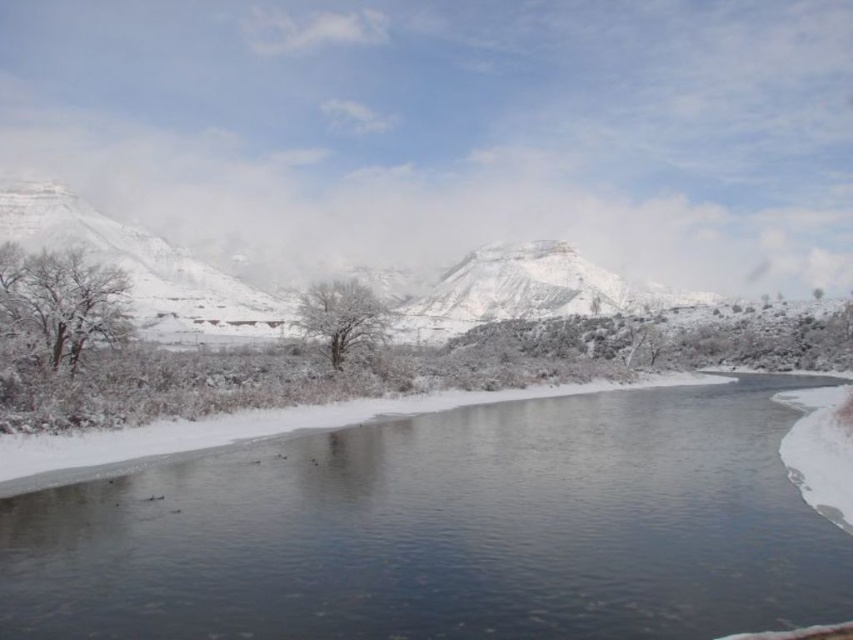
Is snow-covered tree at left wider than white frosty tree at center?

Yes, snow-covered tree at left is wider than white frosty tree at center.

In the scene shown: Is snow-covered tree at left to the right of white frosty tree at center from the viewer's perspective?

No, snow-covered tree at left is not to the right of white frosty tree at center.

This screenshot has width=853, height=640. Find the location of `snow-covered tree at left`. snow-covered tree at left is located at coordinates (61, 304).

Is the position of clear ice stream at lower center less distant than that of white frosty tree at center?

Yes.

Which of these two, clear ice stream at lower center or white frosty tree at center, stands taller?

white frosty tree at center is taller.

Is point (569, 604) closer to viewer compared to point (351, 316)?

Yes, point (569, 604) is in front of point (351, 316).

The height and width of the screenshot is (640, 853). Identify the location of clear ice stream at lower center. (445, 531).

Is clear ice stream at lower center bigger than snow-covered tree at left?

Yes, clear ice stream at lower center is bigger than snow-covered tree at left.

Does clear ice stream at lower center have a lesser width compared to snow-covered tree at left?

Incorrect, clear ice stream at lower center's width is not less than snow-covered tree at left's.

Between point (469, 525) and point (3, 296), which one is positioned in front?

Point (469, 525)

Find the location of `clear ice stream at lower center`. clear ice stream at lower center is located at coordinates (445, 531).